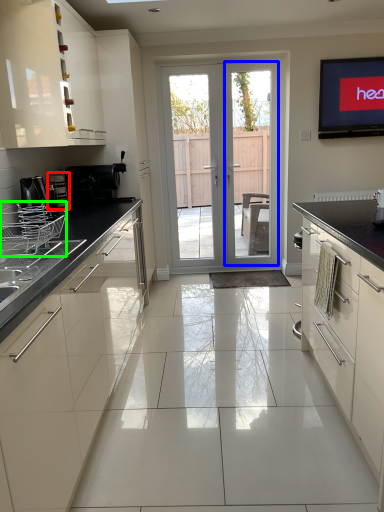
Question: Which object is the farthest from appliance (highlighted by a red box)? Choose among these: screen door (highlighted by a blue box) or appliance (highlighted by a green box).

Choices:
 (A) screen door
 (B) appliance

Answer: (A)